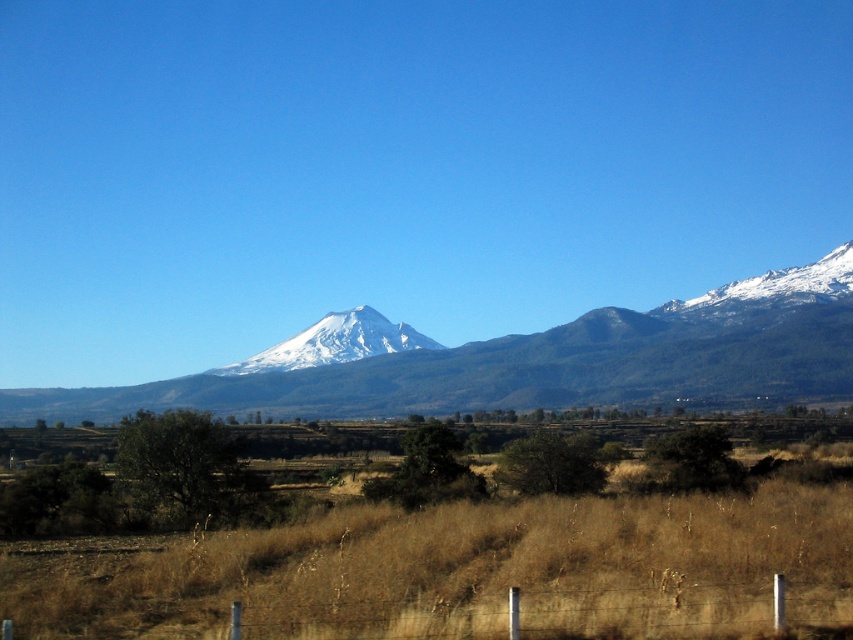
This screenshot has width=853, height=640. What do you see at coordinates (465, 572) in the screenshot?
I see `brown dry grass at lower center` at bounding box center [465, 572].

Is point (480, 513) in front of point (239, 364)?

Yes, it is in front of point (239, 364).

Image resolution: width=853 pixels, height=640 pixels. Find the location of `brown dry grass at lower center`. brown dry grass at lower center is located at coordinates click(465, 572).

Can you confirm if brown dry grass at lower center is smaller than snowy rock mountain at center?

Yes.

Does point (646, 544) lie in front of point (448, 365)?

Yes.

Does point (456, 605) come behind point (474, 342)?

No, (456, 605) is closer to viewer.

You are a GUI agent. You are given a task and a screenshot of the screen. Output one action in this format:
    pyautogui.click(x=<x>, y=<y>)
    Task: Click on the brown dry grass at lower center
    This screenshot has height=640, width=853.
    Given the screenshot: What is the action you would take?
    pyautogui.click(x=465, y=572)

Does snowy rock mountain at center lie in front of white snow-covered mountain at center?

Yes, snowy rock mountain at center is closer to the viewer.

Between snowy rock mountain at center and white snow-covered mountain at center, which one appears on the left side from the viewer's perspective?

From the viewer's perspective, white snow-covered mountain at center appears more on the left side.

Where is `snowy rock mountain at center`? The image size is (853, 640). snowy rock mountain at center is located at coordinates (544, 362).